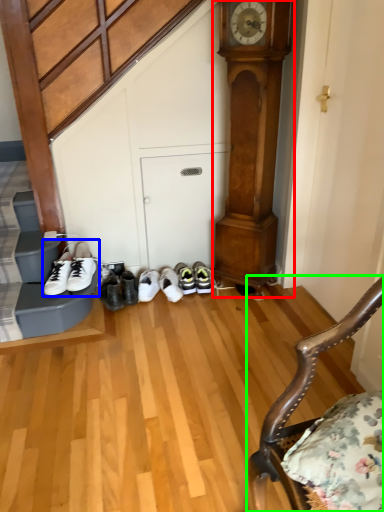
Question: Which is nearer to the clock (highlighted by a red box)? footwear (highlighted by a blue box) or chair (highlighted by a green box).

Choices:
 (A) footwear
 (B) chair

Answer: (A)